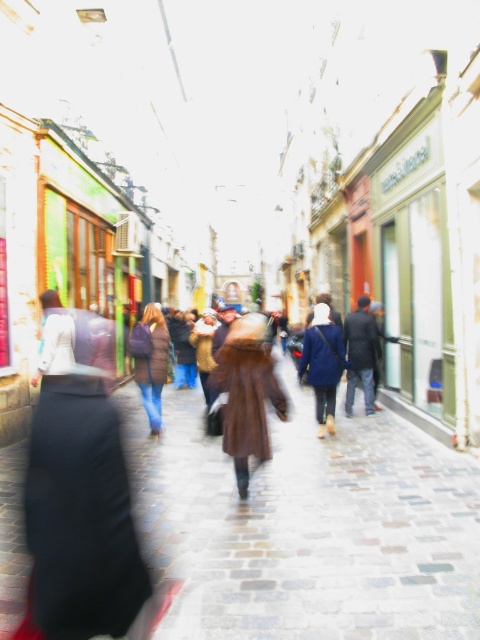
You are standing on the cobblestone pavement at center and want to walk to the point at coordinates 0.823, 0.642. Is that possible?

The cobblestone pavement at center is already located at coordinates (308, 525), so you are already at the desired point.

You are walking on the cobblestone pavement at center and see the brown leather coat at center ahead of you. Which object is closer to you?

The cobblestone pavement at center is closer to the viewer than the brown leather coat at center.